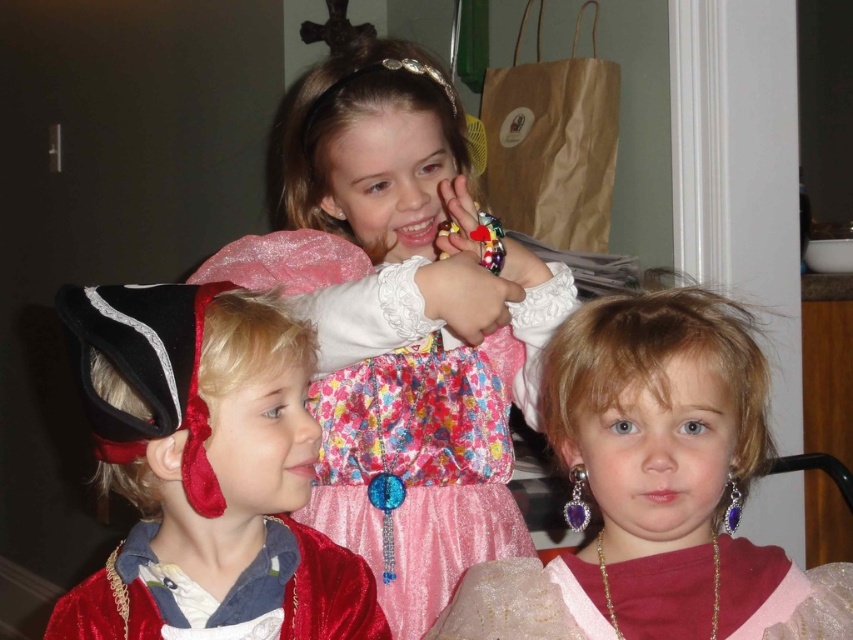
Does pink tulle dress at center appear over velvet red cape at lower left?

Actually, pink tulle dress at center is below velvet red cape at lower left.

How distant is pink tulle dress at center from velvet red cape at lower left?

pink tulle dress at center and velvet red cape at lower left are 20.52 centimeters apart.

Does point (573, 595) come farther from viewer compared to point (305, 580)?

No, it is not.

Locate an element on the screen. pink tulle dress at center is located at coordinates (526, 602).

Can you confirm if fluffy pink dress at center is positioned below pink satin dress at center?

No.

Is fluffy pink dress at center in front of pink satin dress at center?

That is False.

Is point (320, 131) behind point (605, 538)?

Yes, it is.

Where is `fluffy pink dress at center`? The image size is (853, 640). fluffy pink dress at center is located at coordinates tap(401, 324).

Who is taller, fluffy pink dress at center or velvet red cape at lower left?

fluffy pink dress at center is taller.

From the picture: Between fluffy pink dress at center and velvet red cape at lower left, which one appears on the left side from the viewer's perspective?

Positioned to the left is velvet red cape at lower left.

Is point (480, 368) positioned behind point (306, 557)?

Yes, point (480, 368) is farther from viewer.

I want to click on fluffy pink dress at center, so click(x=401, y=324).